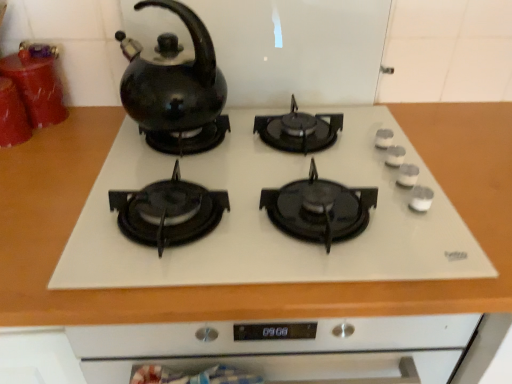
At what (x,y) coordinates should I click in order to perform the action: click on free spot in front of matte red canister at left, which appears as the 1th kitchen appliance when viewed from the front. Please return your answer as a coordinate pair (x, y). The width and height of the screenshot is (512, 384). Looking at the image, I should click on [x=27, y=172].